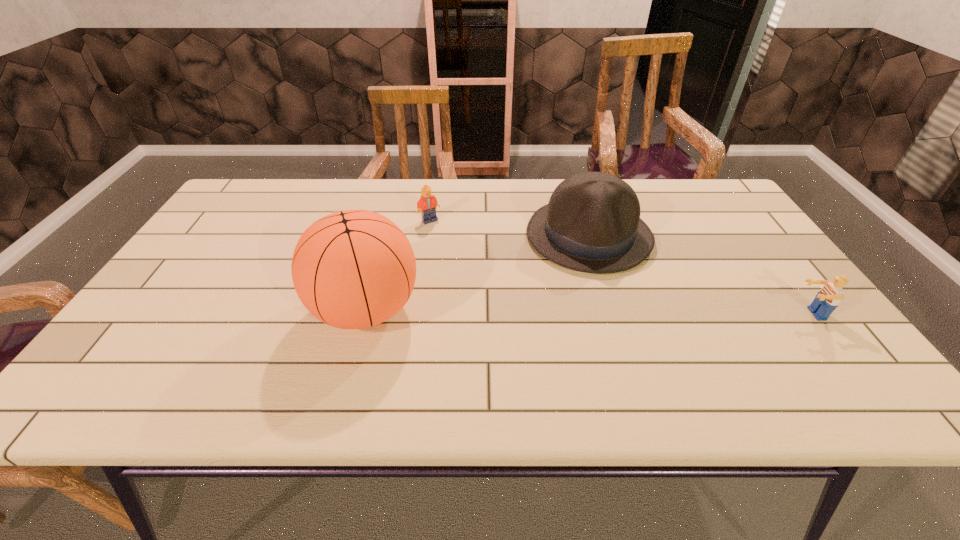
In order to click on the tallest object in this screenshot , I will do `click(352, 269)`.

Where is `the rightmost object`? This screenshot has height=540, width=960. the rightmost object is located at coordinates (828, 298).

Locate an element on the screen. The height and width of the screenshot is (540, 960). the nearer Lego is located at coordinates (828, 298).

In order to click on the fourth shortest object in this screenshot , I will do `click(592, 224)`.

Where is `the second object from right to left`? The width and height of the screenshot is (960, 540). the second object from right to left is located at coordinates (592, 224).

Identify the location of the farther Lego. (427, 204).

Where is `escargot`? This screenshot has width=960, height=540. escargot is located at coordinates (337, 206).

The width and height of the screenshot is (960, 540). I want to click on free space located 0.370m on the right of the tallest object, so click(x=578, y=309).

You are a GUI agent. You are given a task and a screenshot of the screen. Output one action in this format:
    pyautogui.click(x=<x>, y=<y>)
    Task: Click on the free location located on the face of the right Lego
    Image resolution: width=960 pixels, height=540 pixels.
    Given the screenshot: What is the action you would take?
    pyautogui.click(x=646, y=314)

Identify the location of free spot located 0.220m on the face of the right Lego. (702, 314).